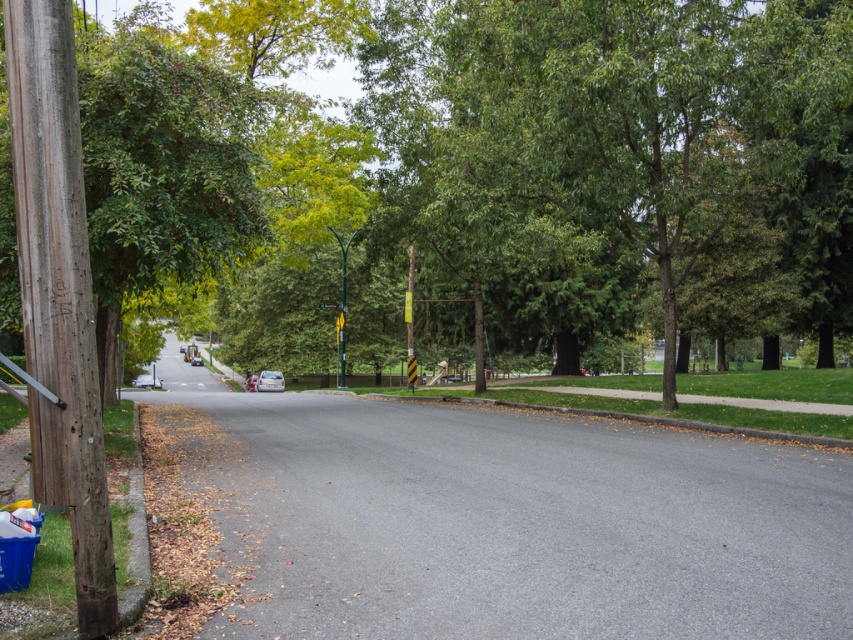
Question: Which of the following is the farthest from the observer?

Choices:
 (A) (341, 307)
 (B) (25, 154)
 (C) (445, 24)

Answer: (A)

Question: Observing the image, what is the correct spatial positioning of green leafy tree at center in reference to metallic pole at center?

Choices:
 (A) above
 (B) below

Answer: (A)

Question: Which object appears farthest from the camera in this image?

Choices:
 (A) green plastic street sign at center
 (B) weathered wood pole at left
 (C) green leafy tree at center

Answer: (A)

Question: Considering the relative positions of green leafy tree at center and weathered wood pole at left in the image provided, where is green leafy tree at center located with respect to weathered wood pole at left?

Choices:
 (A) above
 (B) below

Answer: (A)

Question: Does weathered wood pole at left appear on the left side of metallic pole at center?

Choices:
 (A) yes
 (B) no

Answer: (A)

Question: Which object is positioned closest to the green plastic street sign at center?

Choices:
 (A) green leafy tree at center
 (B) weathered wood pole at left

Answer: (A)